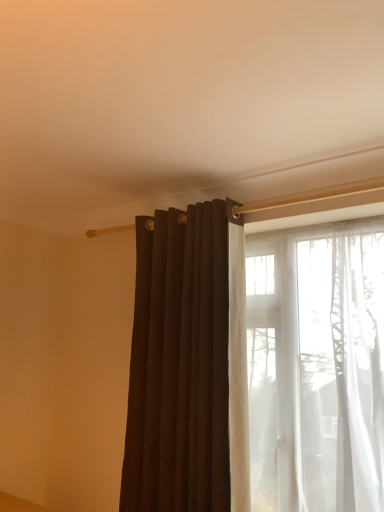
Question: Considering the relative sizes of matte dark brown curtain at center and translucent white curtain at right in the image provided, is matte dark brown curtain at center thinner than translucent white curtain at right?

Choices:
 (A) yes
 (B) no

Answer: (A)

Question: Is matte dark brown curtain at center not near translucent white curtain at right?

Choices:
 (A) no
 (B) yes

Answer: (A)

Question: Is matte dark brown curtain at center positioned in front of translucent white curtain at right?

Choices:
 (A) yes
 (B) no

Answer: (B)

Question: Is matte dark brown curtain at center shorter than translucent white curtain at right?

Choices:
 (A) yes
 (B) no

Answer: (B)

Question: Does matte dark brown curtain at center contain translucent white curtain at right?

Choices:
 (A) yes
 (B) no

Answer: (B)

Question: From a real-world perspective, is matte dark brown curtain at center below translucent white curtain at right?

Choices:
 (A) yes
 (B) no

Answer: (B)

Question: Can you confirm if translucent white curtain at right is wider than matte dark brown curtain at center?

Choices:
 (A) no
 (B) yes

Answer: (B)

Question: From the image's perspective, is translucent white curtain at right on matte dark brown curtain at center?

Choices:
 (A) yes
 (B) no

Answer: (B)

Question: Is translucent white curtain at right to the left of matte dark brown curtain at center from the viewer's perspective?

Choices:
 (A) yes
 (B) no

Answer: (B)

Question: Considering the relative sizes of translucent white curtain at right and matte dark brown curtain at center in the image provided, is translucent white curtain at right smaller than matte dark brown curtain at center?

Choices:
 (A) no
 (B) yes

Answer: (A)

Question: Is translucent white curtain at right further to the viewer compared to matte dark brown curtain at center?

Choices:
 (A) yes
 (B) no

Answer: (B)

Question: Is translucent white curtain at right far away from matte dark brown curtain at center?

Choices:
 (A) no
 (B) yes

Answer: (A)

Question: From the image's perspective, is matte dark brown curtain at center located above or below translucent white curtain at right?

Choices:
 (A) below
 (B) above

Answer: (B)